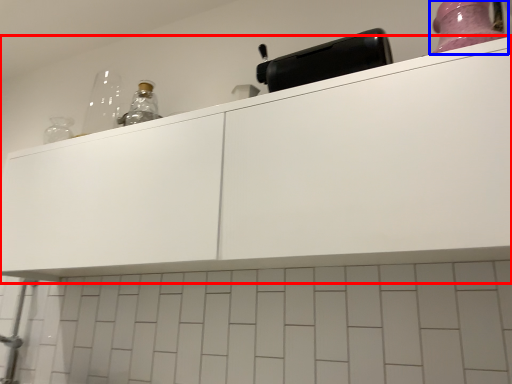
Question: Which point is closer to the camera, cabinetry (highlighted by a red box) or bottle (highlighted by a blue box)?

Choices:
 (A) cabinetry
 (B) bottle

Answer: (A)